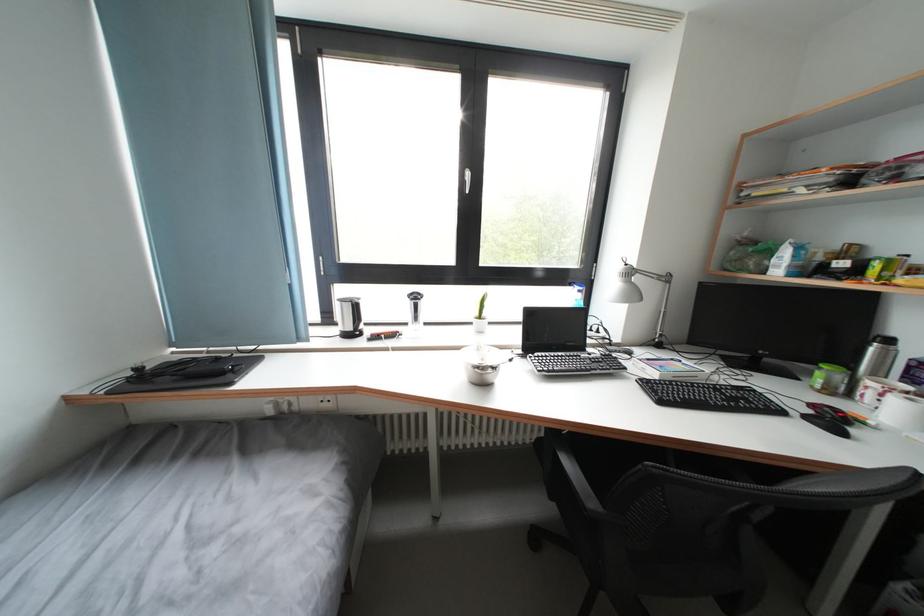
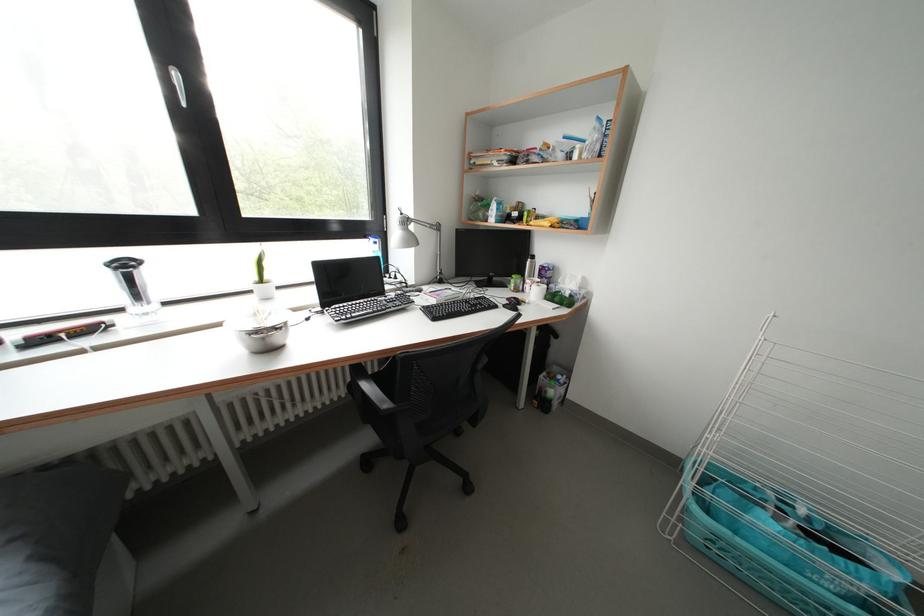
Question: The camera is either moving clockwise (left) or counter-clockwise (right) around the object. The first image is from the beginning of the video and the second image is from the end. Is the camera moving left or right when shooting the video?

Choices:
 (A) Left
 (B) Right

Answer: (A)